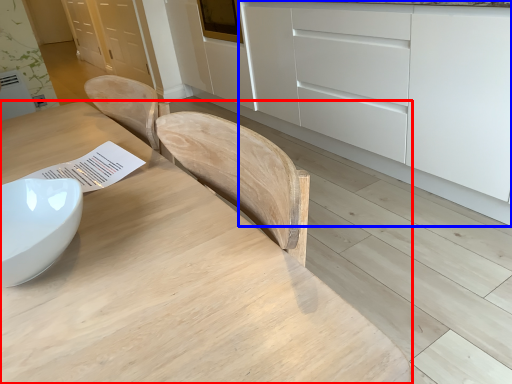
Question: Which object appears farthest to the camera in this image, table (highlighted by a red box) or cabinetry (highlighted by a blue box)?

Choices:
 (A) table
 (B) cabinetry

Answer: (B)